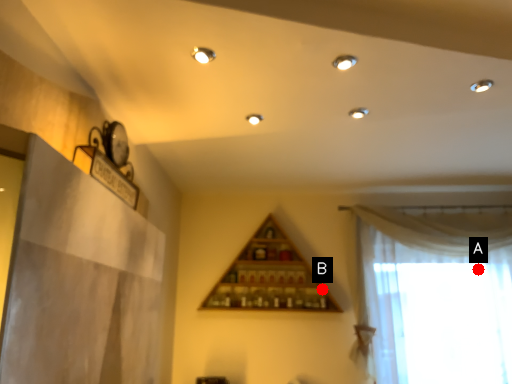
Question: Two points are circled on the image, labeled by A and B beside each circle. Which point is closer to the camera?

Choices:
 (A) A is closer
 (B) B is closer

Answer: (A)